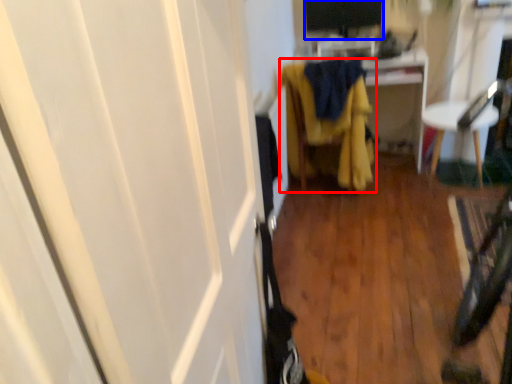
Question: Among these objects, which one is nearest to the camera, furniture (highlighted by a red box) or computer monitor (highlighted by a blue box)?

Choices:
 (A) furniture
 (B) computer monitor

Answer: (A)